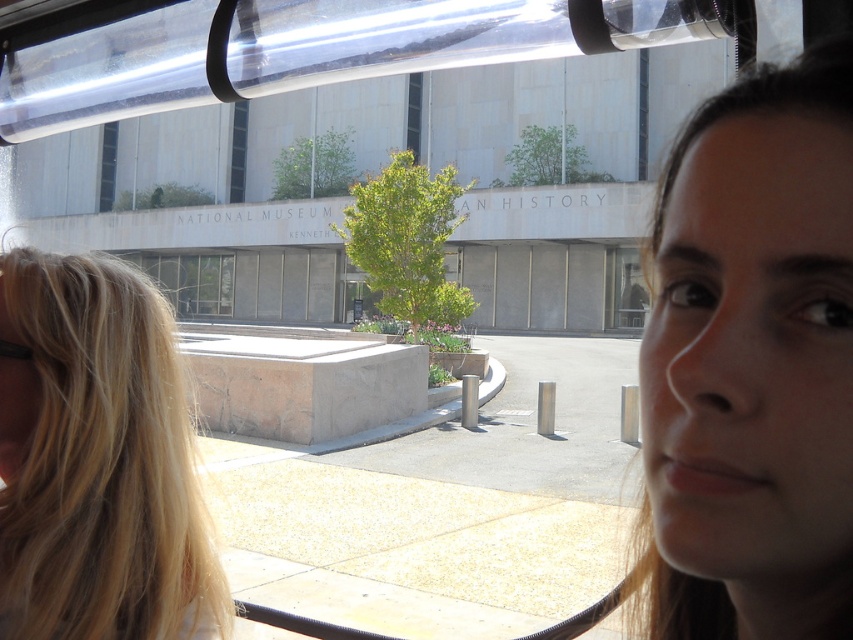
You are a passenger on a bus and want to know if you can reach the clear glass window at center from your seat near the blonde hair at left without leaving your seat. The bus has a maximum reach of 3 meters. Can you reach it?

The distance between blonde hair at left and clear glass window at center is 32.62 meters, which is much greater than the bus maximum reach of 3 meters. Therefore, you cannot reach the clear glass window at center from your seat near the blonde hair at left without leaving your seat.

You are a passenger on a bus and you want to take a photo of the smooth skin face at upper right and the clear glass window at center. Which object is closer to you?

The smooth skin face at upper right is closer to you because it has a smaller size compared to the clear glass window at center.

You are a passenger on a bus and looking through the window. You notice two features in the reflection of the window. One is a smooth skin face at upper right and the other is blonde hair at left. Which feature appears smaller in the reflection?

The smooth skin face at upper right appears smaller in the reflection compared to the blonde hair at left.